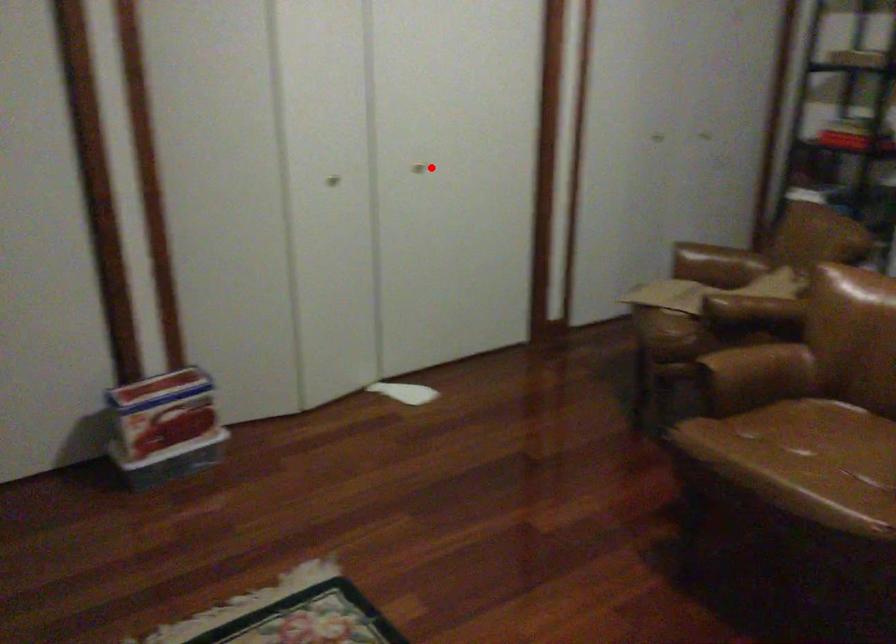
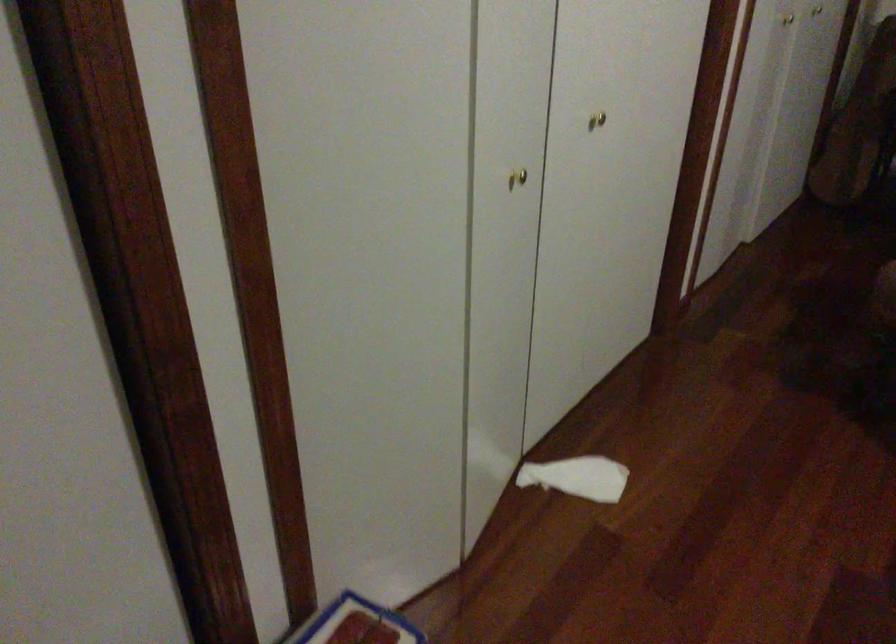
In the second image, find the point that corresponds to the highlighted location in the first image.

(597, 120)